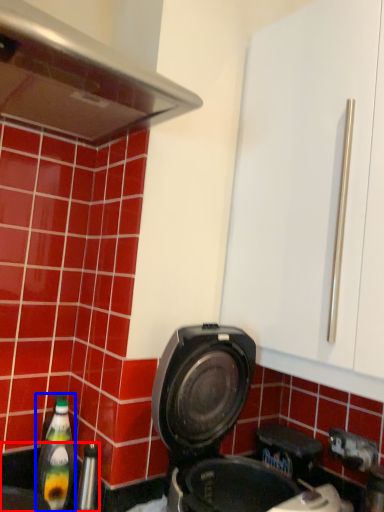
Question: Which object is closer to the camera taking this photo, sink (highlighted by a red box) or bottle (highlighted by a blue box)?

Choices:
 (A) sink
 (B) bottle

Answer: (A)